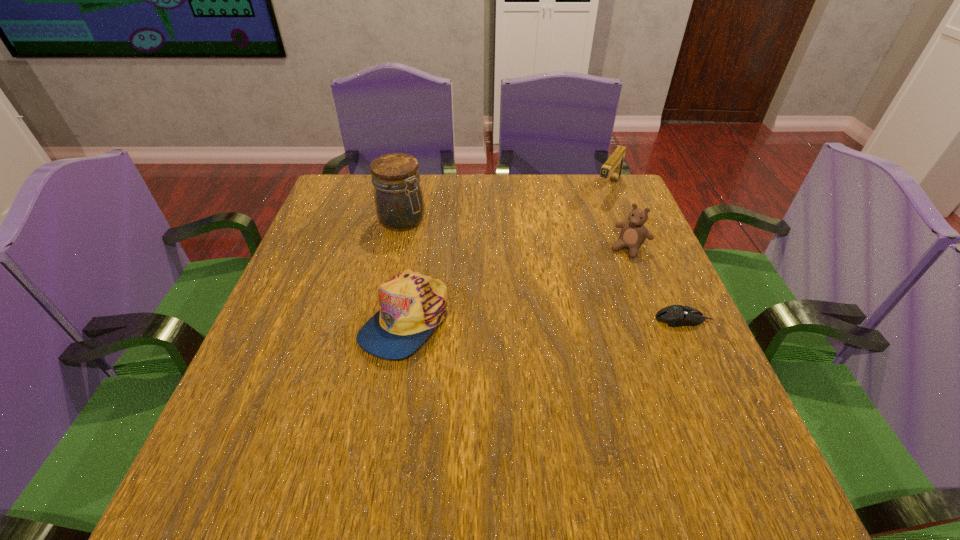
This screenshot has width=960, height=540. I want to click on vacant space on the desktop that is between the cap and the shortest object and is positioned on the lid of the tallest object, so click(533, 319).

Identify the location of free space on the desktop that is between the cap and the computer mouse and is positioned on the front-facing side of the teddy bear. The width and height of the screenshot is (960, 540). (576, 319).

Locate an element on the screen. The image size is (960, 540). free space on the desktop that is between the cap and the shortest object and is positioned at the barrel of the pistol is located at coordinates (515, 319).